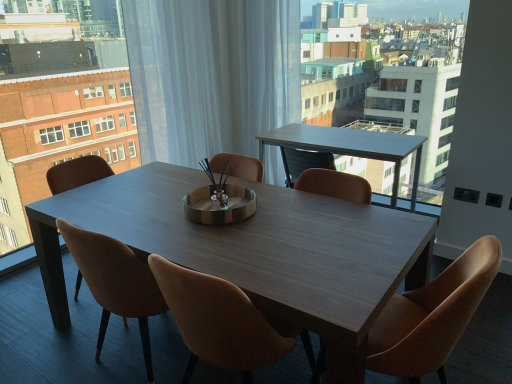
Question: Which direction should I rotate to face brown leather chair at center, the 3th chair positioned from the right, — up or down?

Choices:
 (A) up
 (B) down

Answer: (B)

Question: Can you confirm if wooden table at center is wider than matte wood table at center, which is counted as the first condominium, starting from the left?

Choices:
 (A) yes
 (B) no

Answer: (A)

Question: Could you tell me if wooden table at center is turned towards matte wood table at center, which appears as the 2th condominium when viewed from the right?

Choices:
 (A) yes
 (B) no

Answer: (B)

Question: Is wooden table at center next to matte wood table at center, which is counted as the first condominium, starting from the left?

Choices:
 (A) no
 (B) yes

Answer: (A)

Question: From a real-world perspective, is wooden table at center located beneath matte wood table at center, which is counted as the first condominium, starting from the left?

Choices:
 (A) yes
 (B) no

Answer: (A)

Question: From the image's perspective, is wooden table at center below matte wood table at center, which appears as the 2th condominium when viewed from the right?

Choices:
 (A) no
 (B) yes

Answer: (B)

Question: Is wooden table at center to the left of matte wood table at center, which appears as the 2th condominium when viewed from the right, from the viewer's perspective?

Choices:
 (A) yes
 (B) no

Answer: (B)

Question: Can you confirm if light brown wooden table at upper center is positioned to the left of wooden table at center?

Choices:
 (A) no
 (B) yes

Answer: (A)

Question: Is wooden table at center at the back of light brown wooden table at upper center?

Choices:
 (A) yes
 (B) no

Answer: (A)

Question: Is light brown wooden table at upper center taller than wooden table at center?

Choices:
 (A) no
 (B) yes

Answer: (A)

Question: Is light brown wooden table at upper center with wooden table at center?

Choices:
 (A) yes
 (B) no

Answer: (B)

Question: Is light brown wooden table at upper center at the right side of wooden table at center?

Choices:
 (A) yes
 (B) no

Answer: (A)

Question: From the image's perspective, is light brown wooden table at upper center over wooden table at center?

Choices:
 (A) yes
 (B) no

Answer: (A)

Question: Is leather at center, which is the third chair in left-to-right order, oriented away from brown leather chair at center, which is counted as the 2th chair, starting from the left?

Choices:
 (A) yes
 (B) no

Answer: (B)